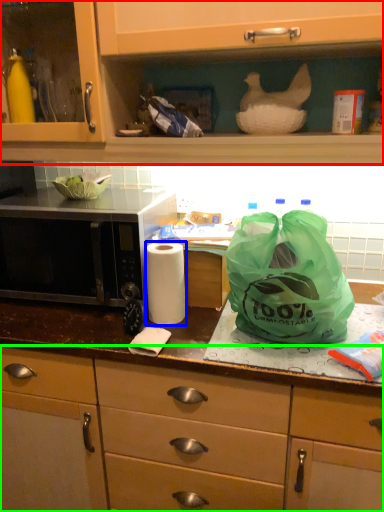
Question: Estimate the real-world distances between objects in this image. Which object is closer to cabinetry (highlighted by a red box), paper towel (highlighted by a blue box) or cabinetry (highlighted by a green box)?

Choices:
 (A) paper towel
 (B) cabinetry

Answer: (A)